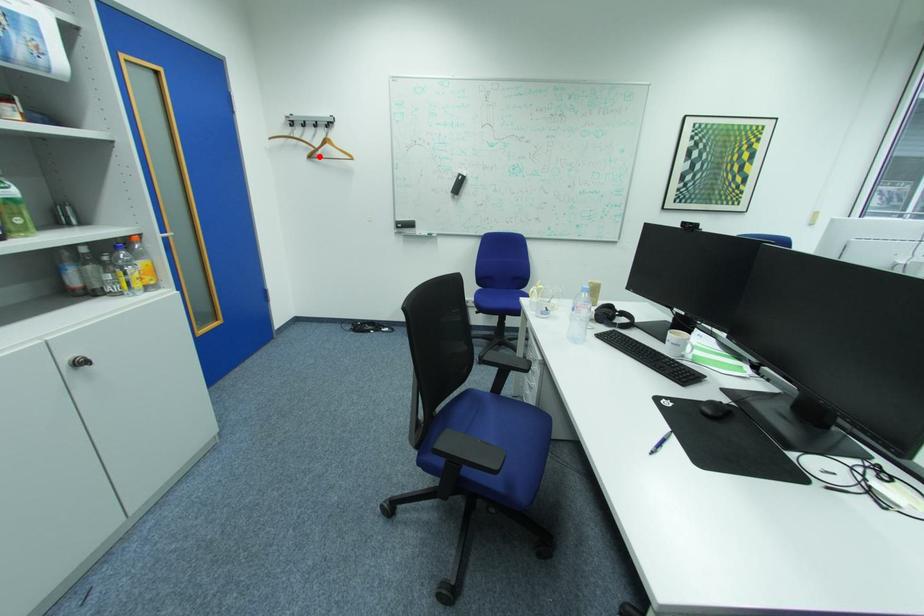
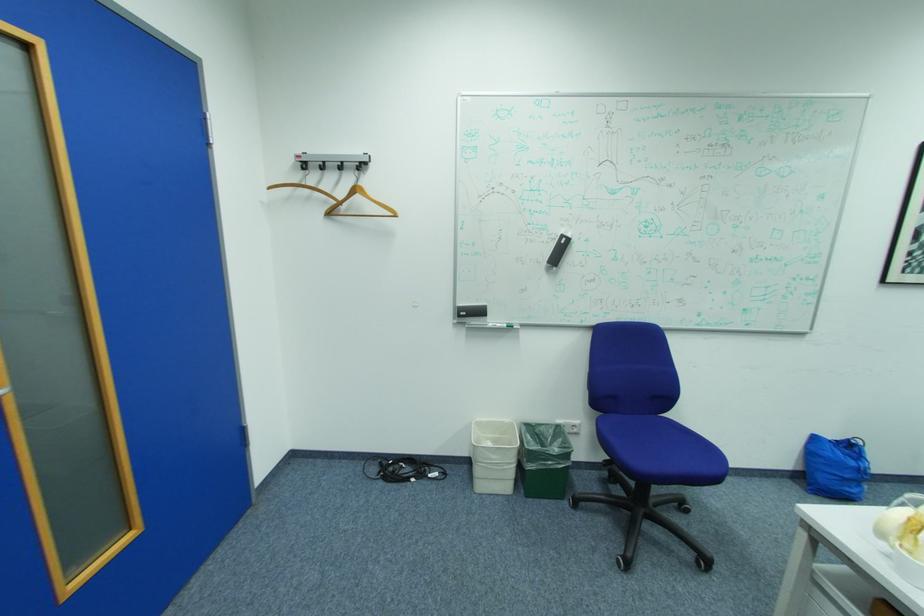
Where in the second image is the point corresponding to the highlighted location from the first image?

(337, 214)